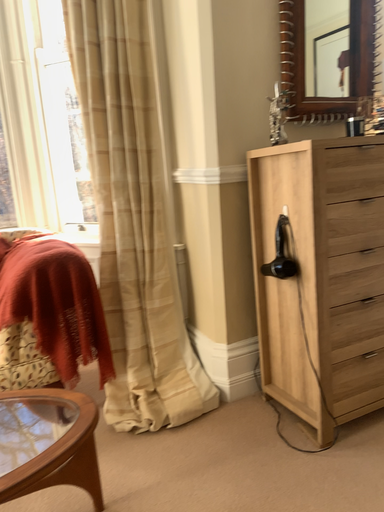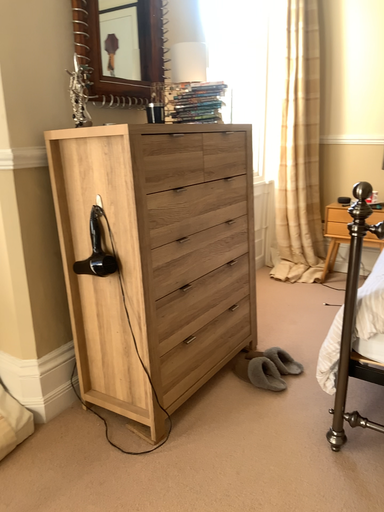
Question: How did the camera likely rotate when shooting the video?

Choices:
 (A) rotated left
 (B) rotated right

Answer: (B)